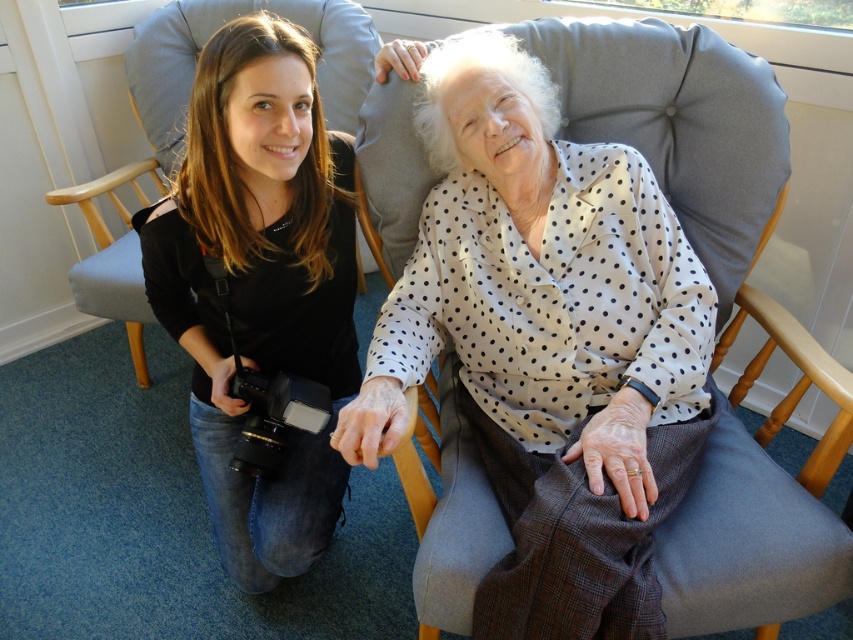
Question: Which of the following is the closest to the observer?

Choices:
 (A) white dotted shirt at center
 (B) white dotted shirt at upper center

Answer: (A)

Question: Is white dotted shirt at center bigger than white dotted shirt at upper center?

Choices:
 (A) yes
 (B) no

Answer: (A)

Question: Which point is closer to the camera?

Choices:
 (A) gray fabric rocking chair at left
 (B) white dotted shirt at center
 (C) white dotted shirt at upper center

Answer: (B)

Question: Is white dotted shirt at center below gray fabric rocking chair at left?

Choices:
 (A) yes
 (B) no

Answer: (A)

Question: Which is farther from the gray fabric rocking chair at left?

Choices:
 (A) white dotted shirt at center
 (B) white dotted shirt at upper center

Answer: (A)

Question: Does white dotted shirt at center appear under gray fabric rocking chair at left?

Choices:
 (A) no
 (B) yes

Answer: (B)